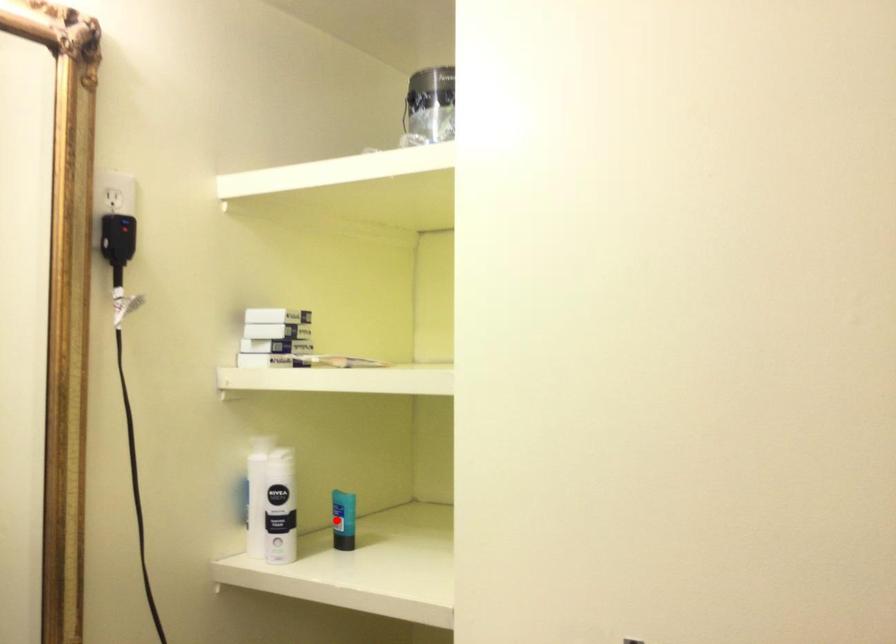
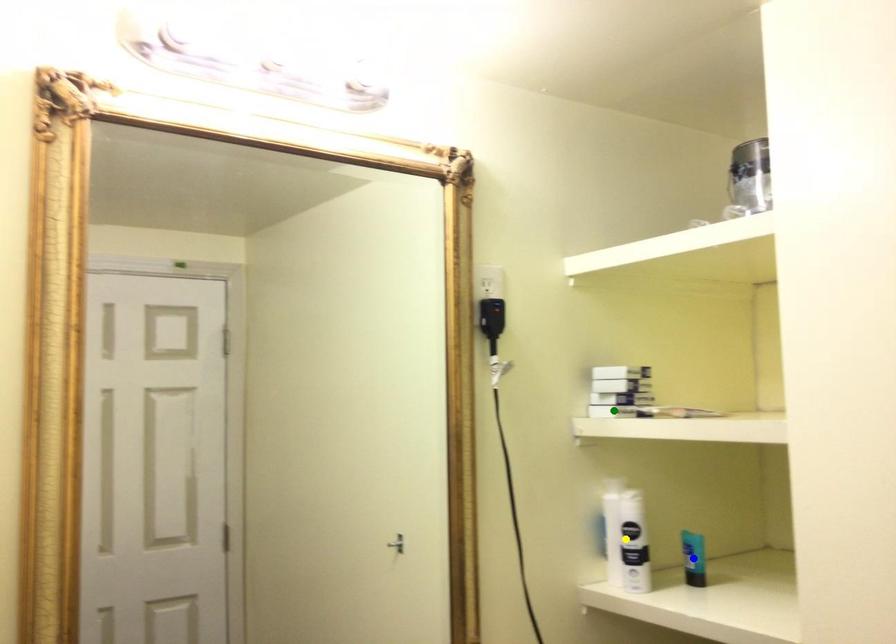
Question: I am providing you with two images of the same scene from different viewpoints. A red point is marked on the first image. You are given multiple points on the second image. In image 2, which mark is for the same physical point as the one in image 1?

Choices:
 (A) blue point
 (B) green point
 (C) yellow point

Answer: (A)